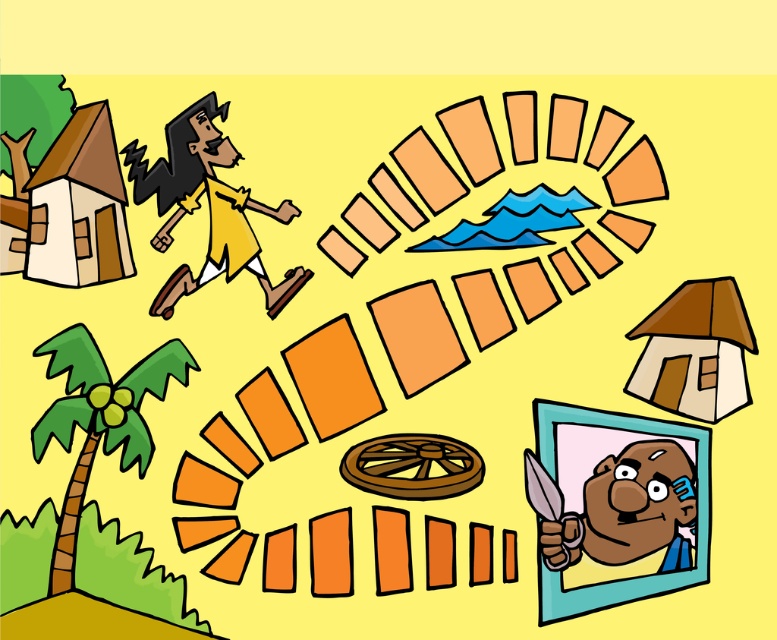
Question: Which object is farther from the camera taking this photo?

Choices:
 (A) smooth brown frame at lower right
 (B) yellow matte/yellowish skin at upper left

Answer: (B)

Question: Is smooth brown frame at lower right smaller than yellow matte/yellowish skin at upper left?

Choices:
 (A) yes
 (B) no

Answer: (B)

Question: Does smooth brown frame at lower right have a greater width compared to yellow matte/yellowish skin at upper left?

Choices:
 (A) yes
 (B) no

Answer: (B)

Question: Is smooth brown frame at lower right smaller than yellow matte/yellowish skin at upper left?

Choices:
 (A) no
 (B) yes

Answer: (A)